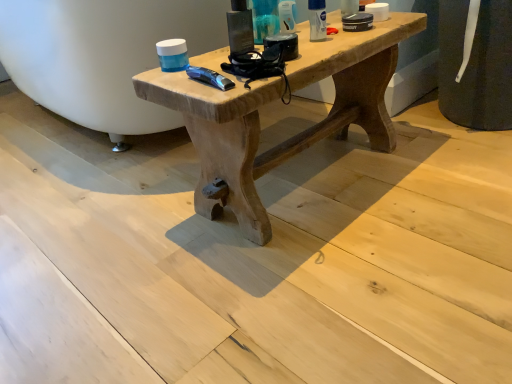
Find the location of `free space to the right of matte plastic container at upper center, placed as the 3th toiletry when sorted from right to left`. free space to the right of matte plastic container at upper center, placed as the 3th toiletry when sorted from right to left is located at coordinates (331, 33).